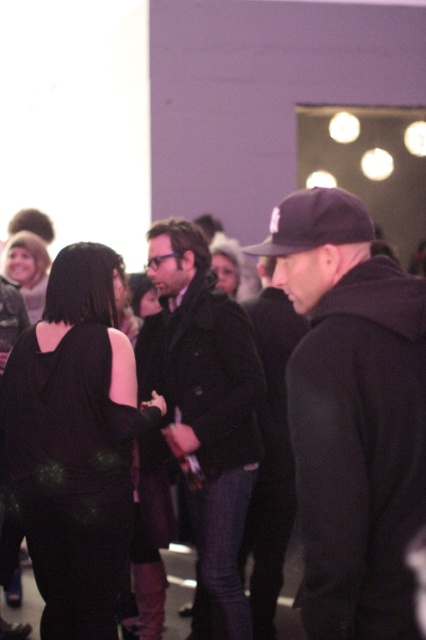
Question: Is black matte cap at center wider than black matte dress at center?

Choices:
 (A) no
 (B) yes

Answer: (A)

Question: Which point appears closest to the camera in this image?

Choices:
 (A) (54, 426)
 (B) (221, 611)
 (C) (14, 273)

Answer: (A)

Question: Does black matte cap at center have a smaller size compared to matte black hair at upper left?

Choices:
 (A) no
 (B) yes

Answer: (A)

Question: Can you confirm if black matte dress at center is positioned above dark wool coat at center?

Choices:
 (A) yes
 (B) no

Answer: (B)

Question: Which point is closer to the camera taking this photo?

Choices:
 (A) tap(242, 250)
 (B) tap(363, 628)

Answer: (B)

Question: Which is nearer to the dark wool coat at center?

Choices:
 (A) black matte dress at center
 (B) black fabric baseball cap at center
 (C) matte black hair at upper left

Answer: (A)